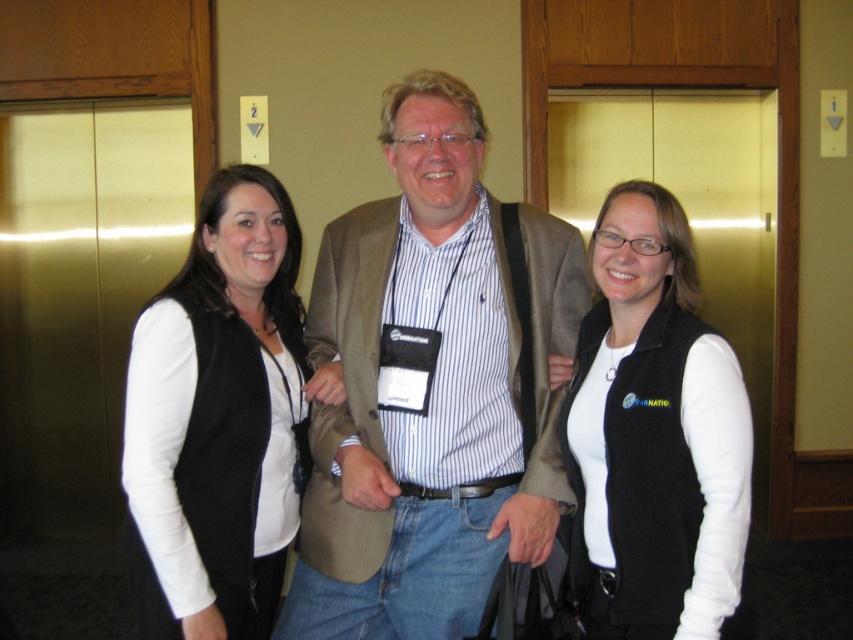
Based on the scene description, where is the striped cotton shirt at center located in terms of coordinates?

The striped cotton shirt at center is located at coordinates point (432, 387).

Based on the scene description, where is the striped cotton shirt at center located in the image?

The striped cotton shirt at center is located at point 0.605 in the x coordinate and 0.508 in the y coordinate.